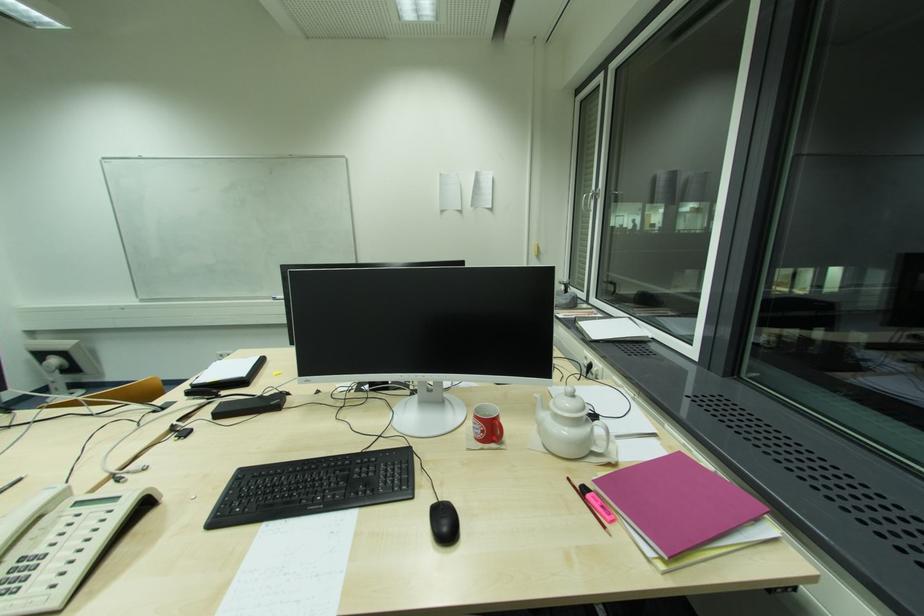
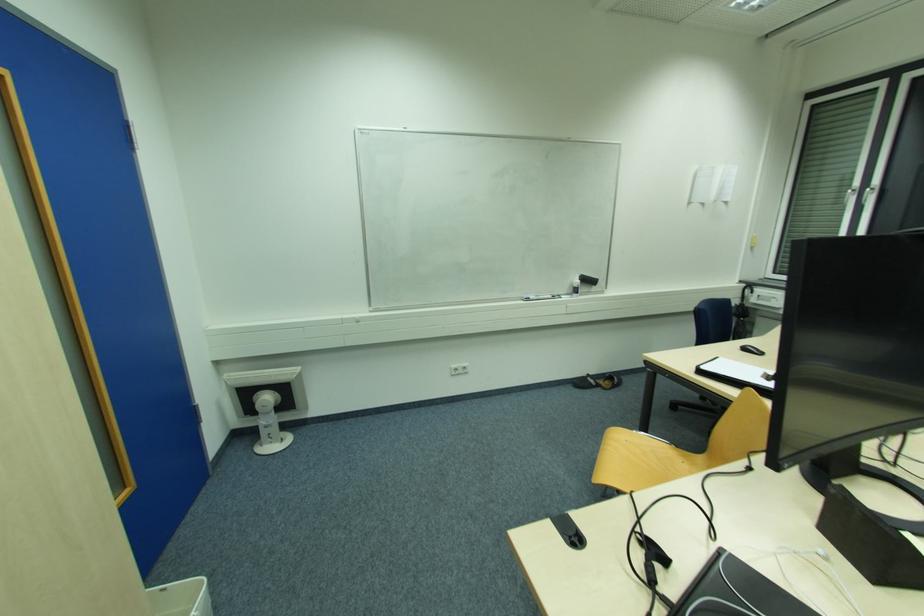
The point at (587, 197) is marked in the first image. Where is the corresponding point in the second image?

(852, 191)